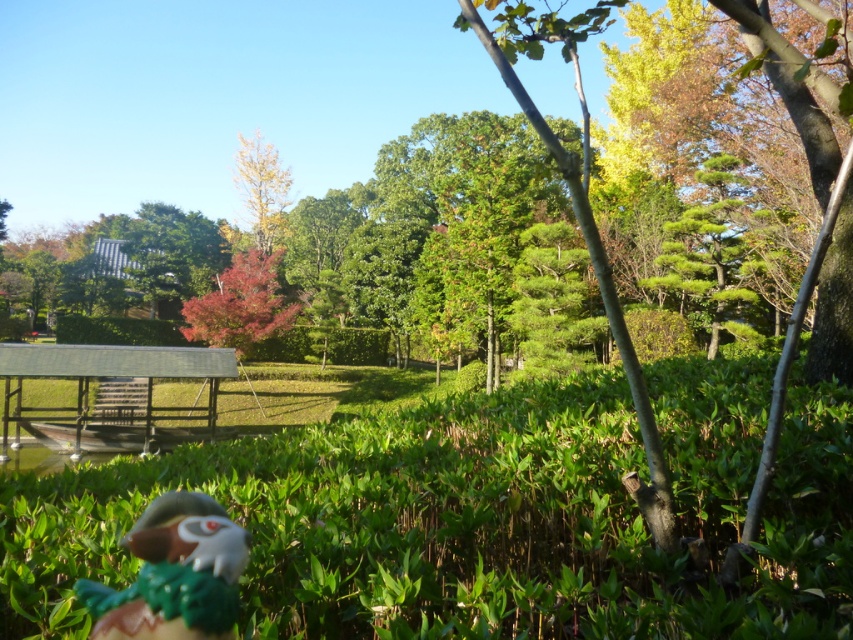
Is shiny plastic bird at lower left shorter than vivid red leaves at center?

Yes.

From the picture: Is the position of shiny plastic bird at lower left more distant than that of vivid red leaves at center?

No, it is not.

Identify the location of shiny plastic bird at lower left. (x=173, y=573).